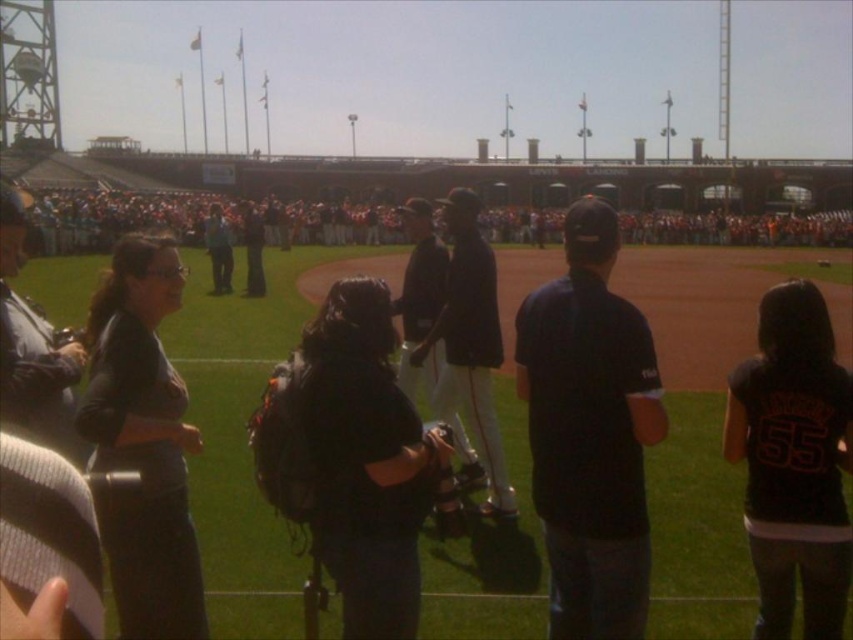
Does point (378, 406) come closer to viewer compared to point (225, 230)?

Yes, it is in front of point (225, 230).

Is black fabric backpack at center behind dark gray hoodie at center?

No, black fabric backpack at center is in front of dark gray hoodie at center.

What do you see at coordinates (357, 460) in the screenshot? The height and width of the screenshot is (640, 853). I see `black fabric backpack at center` at bounding box center [357, 460].

This screenshot has width=853, height=640. In order to click on black fabric backpack at center in this screenshot , I will do `click(357, 460)`.

Who is more forward, [59,195] or [207,252]?

Point [207,252] is more forward.

Between point (381, 227) and point (228, 228), which one is positioned behind?

Positioned behind is point (381, 227).

You are a GUI agent. You are given a task and a screenshot of the screen. Output one action in this format:
    pyautogui.click(x=<x>, y=<y>)
    Task: Click on the white cotton crowd at center
    The width and height of the screenshot is (853, 640).
    Given the screenshot: What is the action you would take?
    pyautogui.click(x=112, y=218)

Which is above, black fabric backpack at center or black leather jacket at center?

black leather jacket at center

Consider the image. Between black fabric backpack at center and black leather jacket at center, which one appears on the right side from the viewer's perspective?

black fabric backpack at center

The width and height of the screenshot is (853, 640). I want to click on black fabric backpack at center, so click(x=357, y=460).

The image size is (853, 640). What are the coordinates of `black fabric backpack at center` in the screenshot? It's located at (357, 460).